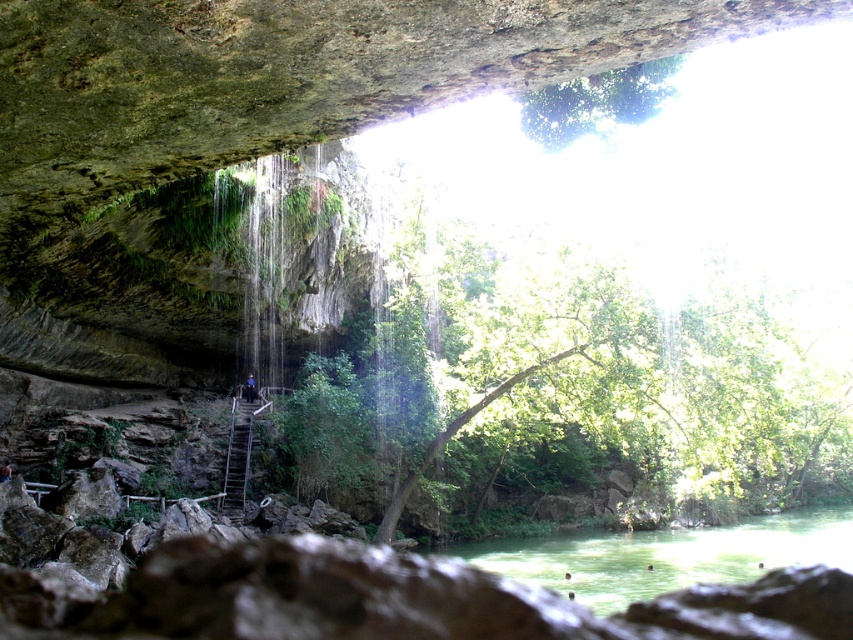
You are a hiker carrying a backpack and need to cross from the cave entrance to the exit on the other side. The path goes through the green translucent water at lower center and the metallic staircase at center. Which part of the path is wider?

The green translucent water at lower center is wider than the metallic staircase at center, so the water part of the path is wider.

You are a hiker who wants to cross from the cave to the waterfall area. The metallic staircase at center is your only path. Can you safely step onto the green translucent water at lower center from the staircase?

The green translucent water at lower center is taller than metallic staircase at center, so stepping onto it from the staircase might be risky as the water is higher than the staircase. It is safer to avoid stepping onto the water and use the staircase as intended.